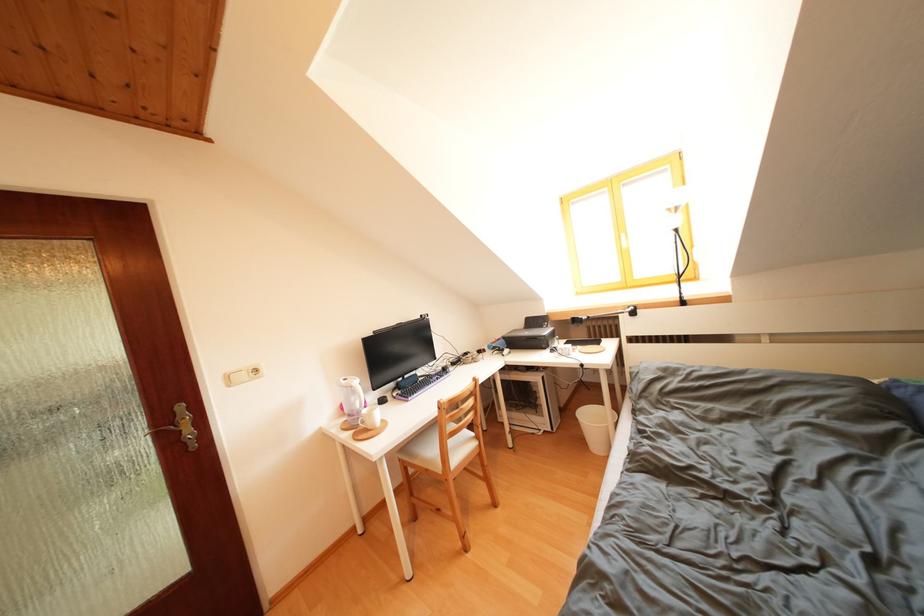
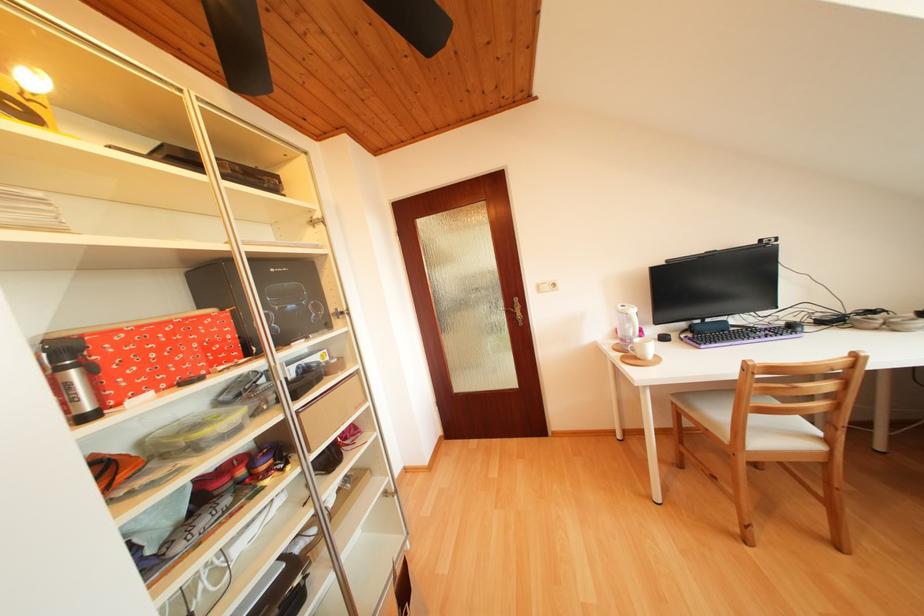
Where in the second image is the point corresponding to (149,428) from the first image?

(509, 309)